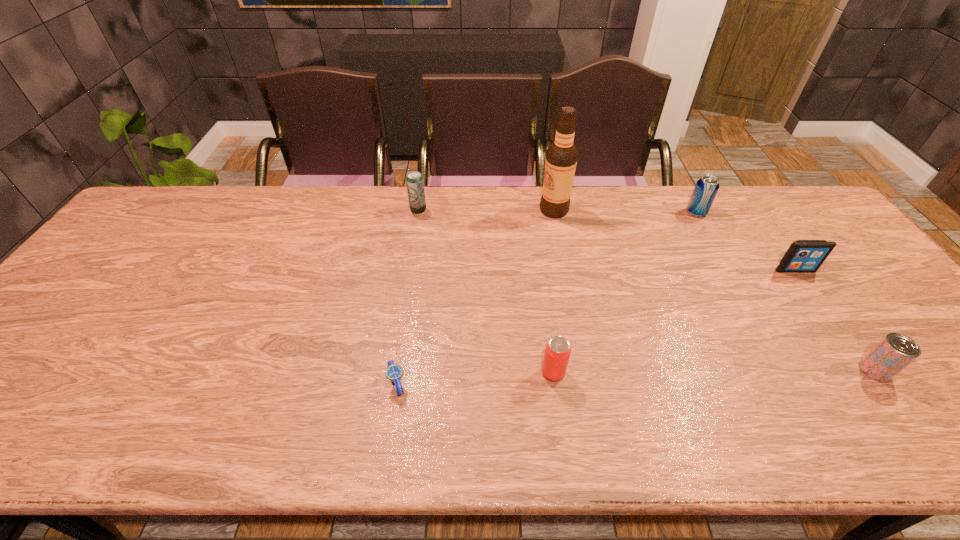
The height and width of the screenshot is (540, 960). Find the location of `vacant area between the rightmost beer can and the shortest object`. vacant area between the rightmost beer can and the shortest object is located at coordinates (636, 377).

I want to click on free spot between the second beer can from left to right and the watch, so click(475, 378).

Where is `vacant area between the iPod and the alcohol`? The width and height of the screenshot is (960, 540). vacant area between the iPod and the alcohol is located at coordinates (675, 240).

Identify the location of empty space between the watch and the third beer can from right to left. This screenshot has width=960, height=540. (475, 378).

You are a GUI agent. You are given a task and a screenshot of the screen. Output one action in this format:
    pyautogui.click(x=<x>, y=<y>)
    Task: Click on the closest object to the tallest object
    
    Given the screenshot: What is the action you would take?
    pyautogui.click(x=415, y=185)

Identify which object is the third nearest to the third object from right to left. Please provide its 2D coordinates. Your answer should be formatted as a tuple, i.e. [(x, y)], where the tuple contains the x and y coordinates of a point satisfying the conditions above.

[(895, 351)]

Locate an element on the screen. beer can that is the nearest to the second beer can from left to right is located at coordinates (415, 185).

Select which beer can appears as the third closest to the alcohol. Please provide its 2D coordinates. Your answer should be formatted as a tuple, i.e. [(x, y)], where the tuple contains the x and y coordinates of a point satisfying the conditions above.

[(557, 352)]

The height and width of the screenshot is (540, 960). What are the coordinates of `blank space that satisfies the following two spatial constraints: 1. on the label of the alcohol; 2. on the back side of the rightmost beer can` in the screenshot? It's located at (585, 370).

Where is `free space that satisfies the following two spatial constraints: 1. on the label of the alcohol; 2. on the right side of the rightmost beer can`? The height and width of the screenshot is (540, 960). free space that satisfies the following two spatial constraints: 1. on the label of the alcohol; 2. on the right side of the rightmost beer can is located at coordinates (585, 370).